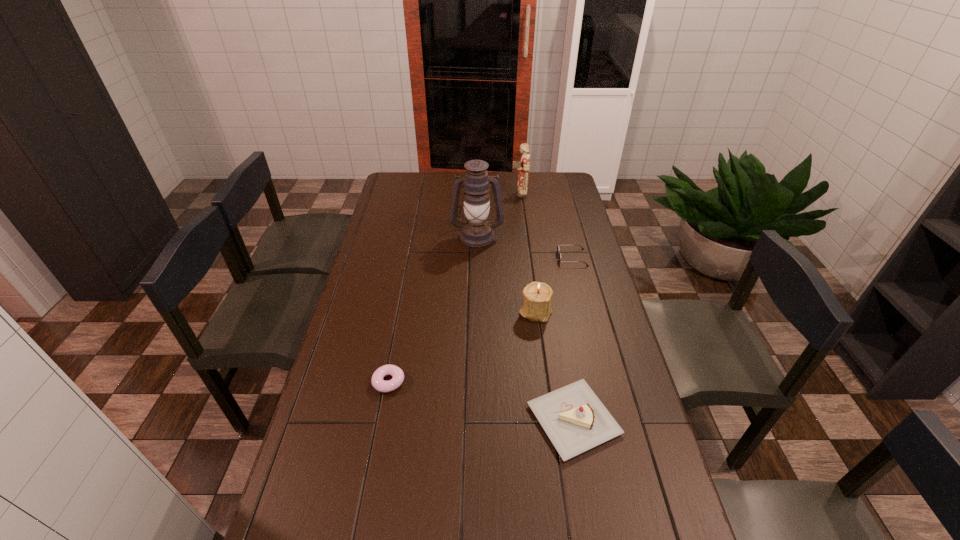
Find the location of `empty space that is in between the second tallest object and the third tallest object`. empty space that is in between the second tallest object and the third tallest object is located at coordinates (527, 252).

Identify the location of free space between the doughnut and the fourth nearest object. Image resolution: width=960 pixels, height=540 pixels. (480, 320).

At what (x,y) coordinates should I click in order to perform the action: click on unoccupied position between the fourth farthest object and the sunglasses. Please return your answer as a coordinate pair (x, y). This screenshot has height=540, width=960. Looking at the image, I should click on coord(554,285).

This screenshot has height=540, width=960. I want to click on vacant point located between the third shortest object and the fourth farthest object, so click(555, 366).

Identify the location of free spot between the sunglasses and the figurine. (545, 226).

At what (x,y) coordinates should I click in order to perform the action: click on free spot between the leftmost object and the fourth nearest object. Please return your answer as a coordinate pair (x, y). This screenshot has width=960, height=540. Looking at the image, I should click on (480, 320).

Where is `the fourth closest object to the third shortest object`? This screenshot has height=540, width=960. the fourth closest object to the third shortest object is located at coordinates (476, 231).

Find the location of `the third closest object relative to the candle_holder`. the third closest object relative to the candle_holder is located at coordinates tap(476, 231).

Locate an element on the screen. Image resolution: width=960 pixels, height=540 pixels. free spot that satisfies the following two spatial constraints: 1. on the front-facing side of the second tallest object; 2. on the right side of the fourth shortest object is located at coordinates (534, 311).

I want to click on free space that satisfies the following two spatial constraints: 1. on the front-facing side of the fourth nearest object; 2. on the front side of the third nearest object, so click(x=586, y=311).